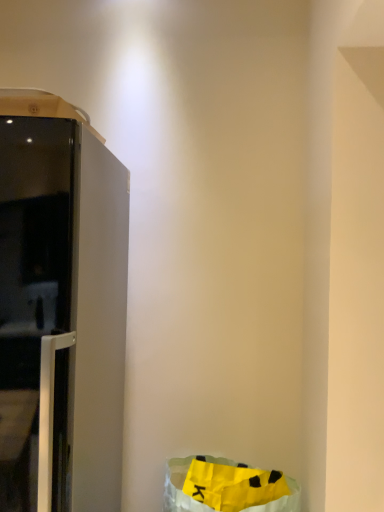
Question: Is satin white refrigerator at left shorter than yellow paper bag at lower right?

Choices:
 (A) yes
 (B) no

Answer: (B)

Question: Is yellow paper bag at lower right at the back of satin white refrigerator at left?

Choices:
 (A) yes
 (B) no

Answer: (B)

Question: Does satin white refrigerator at left come in front of yellow paper bag at lower right?

Choices:
 (A) yes
 (B) no

Answer: (A)

Question: Can you confirm if satin white refrigerator at left is thinner than yellow paper bag at lower right?

Choices:
 (A) yes
 (B) no

Answer: (B)

Question: Considering the relative sizes of satin white refrigerator at left and yellow paper bag at lower right in the image provided, is satin white refrigerator at left wider than yellow paper bag at lower right?

Choices:
 (A) no
 (B) yes

Answer: (B)

Question: From the image's perspective, is satin white refrigerator at left located above yellow paper bag at lower right?

Choices:
 (A) yes
 (B) no

Answer: (A)

Question: Does yellow paper bag at lower right have a lesser width compared to satin white refrigerator at left?

Choices:
 (A) no
 (B) yes

Answer: (B)

Question: Is yellow paper bag at lower right positioned beyond the bounds of satin white refrigerator at left?

Choices:
 (A) yes
 (B) no

Answer: (A)

Question: Considering the relative sizes of yellow paper bag at lower right and satin white refrigerator at left in the image provided, is yellow paper bag at lower right smaller than satin white refrigerator at left?

Choices:
 (A) yes
 (B) no

Answer: (A)

Question: From the image's perspective, would you say yellow paper bag at lower right is shown under satin white refrigerator at left?

Choices:
 (A) yes
 (B) no

Answer: (A)

Question: Considering the relative sizes of yellow paper bag at lower right and satin white refrigerator at left in the image provided, is yellow paper bag at lower right wider than satin white refrigerator at left?

Choices:
 (A) yes
 (B) no

Answer: (B)

Question: Is yellow paper bag at lower right facing away from satin white refrigerator at left?

Choices:
 (A) no
 (B) yes

Answer: (A)

Question: Considering the positions of satin white refrigerator at left and yellow paper bag at lower right in the image, is satin white refrigerator at left wider or thinner than yellow paper bag at lower right?

Choices:
 (A) wide
 (B) thin

Answer: (A)